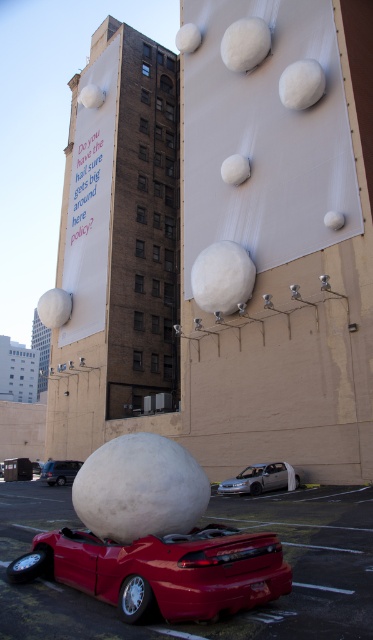
From the picture: You are standing in front of the building and want to get to your metallic red car at lower center. The path is clear, but you need to know if you can carry a 3.5 meter long ladder horizontally without it hitting anything. Can you do it?

The metallic red car at lower center and viewer are 4.35 meters apart. Since the ladder is 3.5 meters long and the distance is 4.35 meters, the ladder can be carried horizontally as there is enough space between you and the car.

You are standing at the entrance of the building and want to park your car in the parking lot. The shiny red car at lower center is represented by point (163,570). Based on its coordinates, is the shiny red car at lower center closer to the building or the entrance?

The coordinates of the shiny red car at lower center are point (163,570). Since the entrance is at the building side, the car is closer to the entrance than the building.

You are a parking attendant who needs to direct a visitor to park their car. The visitor wants to park their car next to the silver metallic sedan at center. Where should they position their car relative to the metallic red car at lower center?

The visitor should position their car to the right of the metallic red car at lower center, as the metallic red car at lower center is to the left of the silver metallic sedan at center.